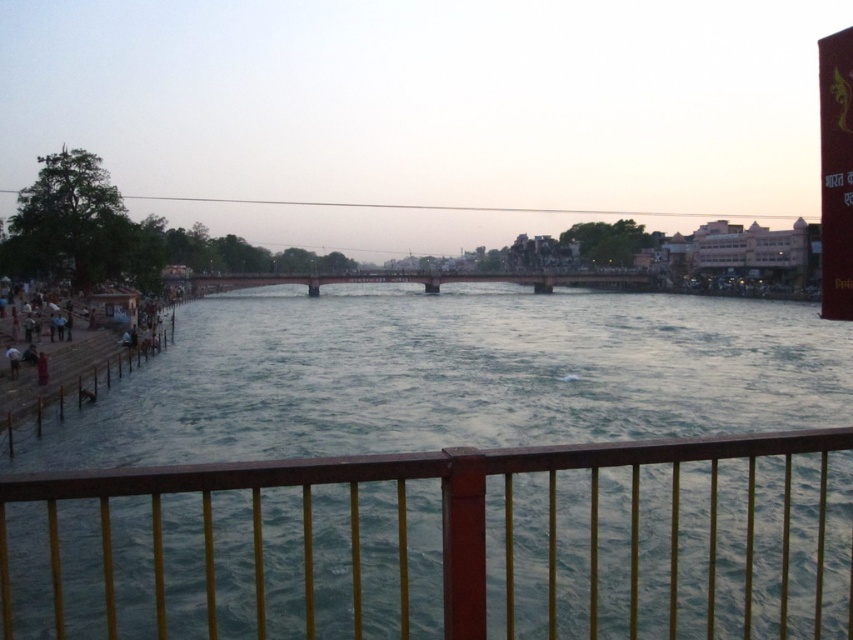
Does red plastic sign at upper right appear over dark blue fabric person at lower left?

Yes, red plastic sign at upper right is above dark blue fabric person at lower left.

Which is above, red plastic sign at upper right or dark blue fabric person at lower left?

red plastic sign at upper right is above.

The height and width of the screenshot is (640, 853). What do you see at coordinates (834, 173) in the screenshot?
I see `red plastic sign at upper right` at bounding box center [834, 173].

Where is `red plastic sign at upper right`? red plastic sign at upper right is located at coordinates (834, 173).

Is wooden dock at lower left smaller than red plastic sign at upper right?

Yes.

Is wooden dock at lower left wider than red plastic sign at upper right?

No, wooden dock at lower left is not wider than red plastic sign at upper right.

Is point (167, 332) positioned before point (842, 132)?

That is False.

At what (x,y) coordinates should I click in order to perform the action: click on wooden dock at lower left. Please return your answer as a coordinate pair (x, y). The height and width of the screenshot is (640, 853). Looking at the image, I should click on (73, 378).

Does brown wooden fence at lower center have a lesser width compared to metallic bridge at center?

Correct, brown wooden fence at lower center's width is less than metallic bridge at center's.

Is brown wooden fence at lower center behind metallic bridge at center?

That is False.

Locate an element on the screen. The width and height of the screenshot is (853, 640). brown wooden fence at lower center is located at coordinates (444, 545).